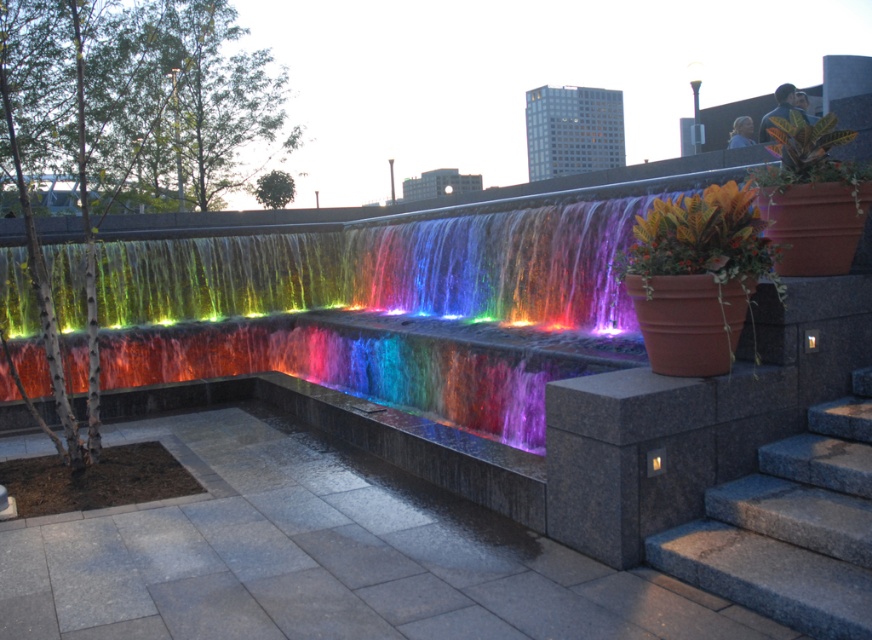
You are standing at the center of the urban water feature and want to place a new decorative item exactly at the same position as the terracotta pot at right. What coordinates should you aim for?

The terracotta pot at right is located at coordinates point (696, 276), so you should aim for those coordinates to place the new decorative item.

You are a maintenance worker needing to reach the green glossy leafy plant at upper right to prune it. You have a ladder that is 1.5 meters tall. The granite steps at lower right are 2 meters tall. Can you safely reach the plant using the ladder placed on the steps?

The granite steps at lower right is taller than green glossy leafy plant at upper right. Since the steps are 2 meters tall and the plant is shorter than that, the ladder placed on the steps can provide the necessary height to reach the plant safely.